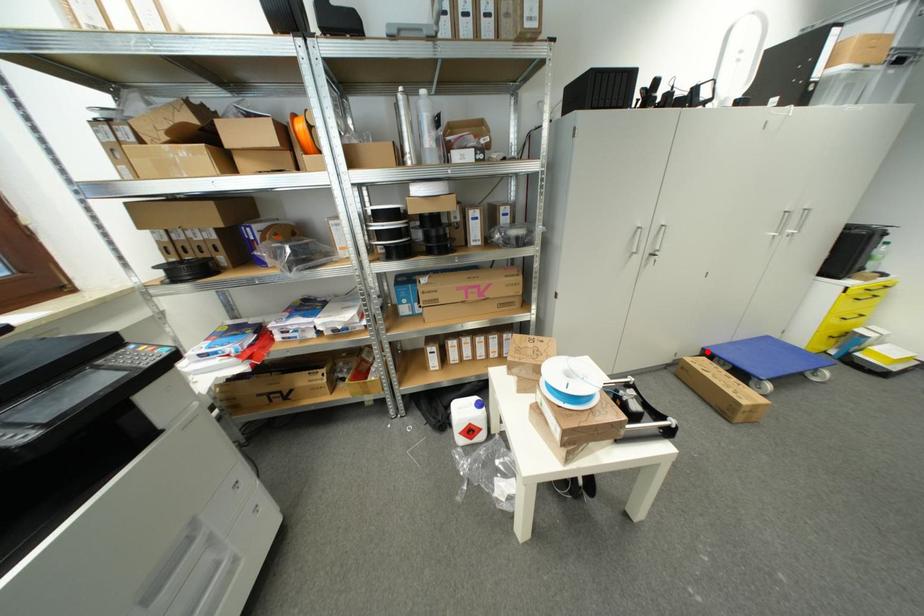
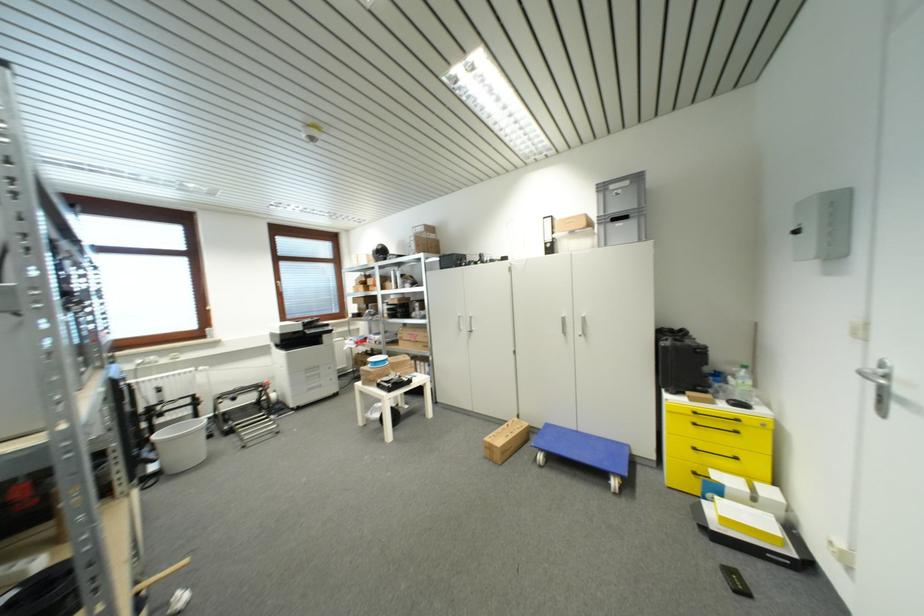
In the second image, find the point that corresponds to the highlighted location in the first image.

(552, 427)